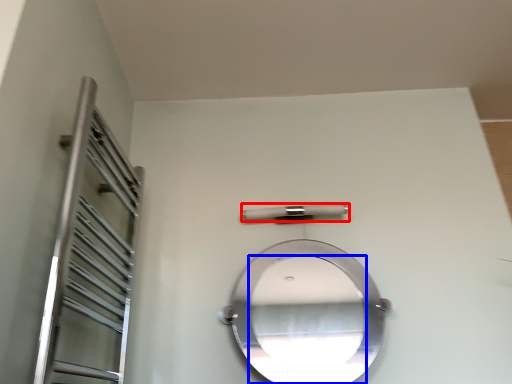
Question: Which object is further to the camera taking this photo, door handle (highlighted by a red box) or mirror (highlighted by a blue box)?

Choices:
 (A) door handle
 (B) mirror

Answer: (A)